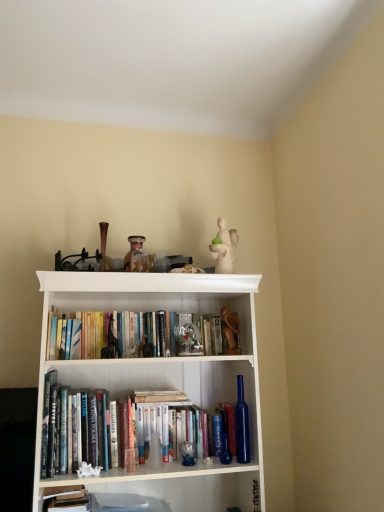
Where is `free spot in front of matte glass jar at upper center, positioned as the 2th toy in top-to-bottom order`? The width and height of the screenshot is (384, 512). free spot in front of matte glass jar at upper center, positioned as the 2th toy in top-to-bottom order is located at coordinates (129, 281).